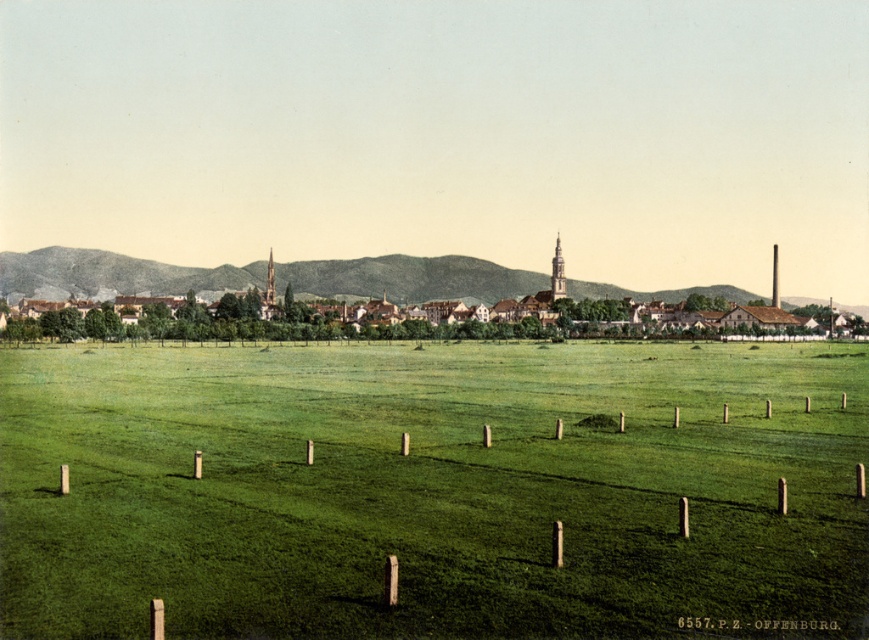
Which is more to the right, green grass at center or brown wooden houses at center?

Positioned to the right is brown wooden houses at center.

Does green grass at center have a lesser width compared to brown wooden houses at center?

Yes.

I want to click on green grass at center, so click(x=432, y=490).

Looking at this image, does green grass at center have a greater height compared to brown wooden posts at lower center?

Indeed, green grass at center has a greater height compared to brown wooden posts at lower center.

How far apart are green grass at center and brown wooden posts at lower center?

The distance of green grass at center from brown wooden posts at lower center is 21.57 meters.

At what (x,y) coordinates should I click in order to perform the action: click on green grass at center. Please return your answer as a coordinate pair (x, y). This screenshot has width=869, height=640. Looking at the image, I should click on (432, 490).

Which of these two, brown wooden houses at center or brown wooden posts at lower center, stands shorter?

brown wooden posts at lower center is shorter.

Who is lower down, brown wooden houses at center or brown wooden posts at lower center?

brown wooden posts at lower center is below.

Locate an element on the screen. Image resolution: width=869 pixels, height=640 pixels. brown wooden houses at center is located at coordinates (x=114, y=275).

Where is `brown wooden houses at center`? The image size is (869, 640). brown wooden houses at center is located at coordinates (114, 275).